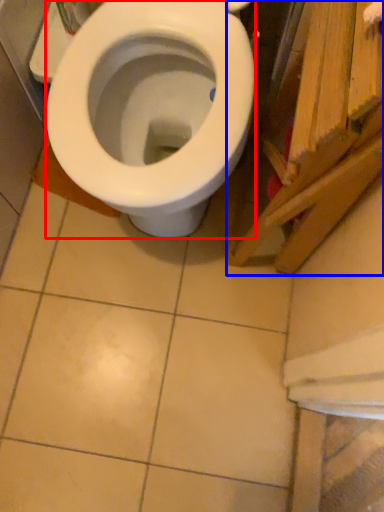
Question: Which of the following is the farthest to the observer, bidet (highlighted by a red box) or wood (highlighted by a blue box)?

Choices:
 (A) bidet
 (B) wood

Answer: (A)